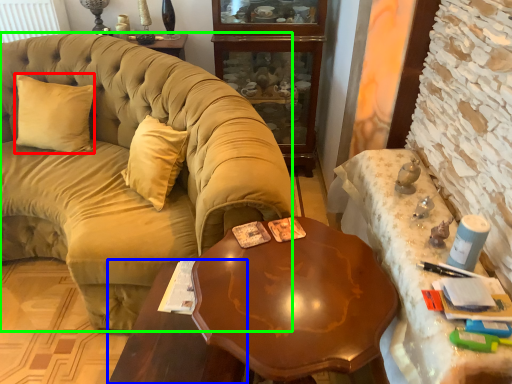
Question: Which object is positioned farthest from pillow (highlighted by a red box)? Select from table (highlighted by a blue box) and studio couch (highlighted by a green box).

Choices:
 (A) table
 (B) studio couch

Answer: (A)